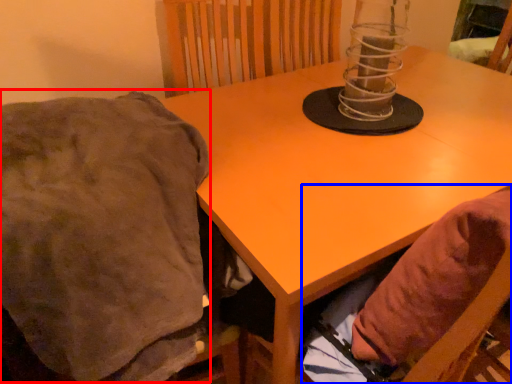
Question: Which of the following is the closest to the observer, blanket (highlighted by a red box) or bean bag chair (highlighted by a blue box)?

Choices:
 (A) blanket
 (B) bean bag chair

Answer: (A)